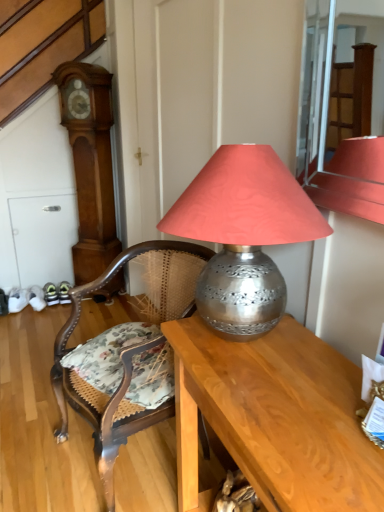
Identify the location of free region under metallic silver lamp at center (from a real-world perspective). (233, 346).